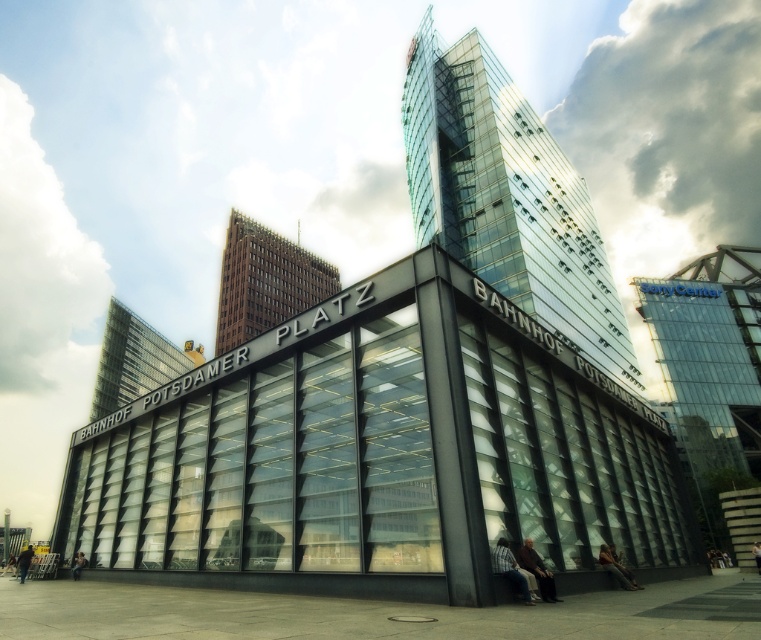
Looking at this image, can you confirm if brown leather jacket at lower right is smaller than dark blue jeans at lower left?

Yes.

Is brown leather jacket at lower right shorter than dark blue jeans at lower left?

Yes.

Between point (521, 552) and point (21, 570), which one is positioned behind?

Positioned behind is point (21, 570).

At what (x,y) coordinates should I click in order to perform the action: click on brown leather jacket at lower right. Please return your answer as a coordinate pair (x, y). Looking at the image, I should click on (537, 570).

Can you confirm if glassy steel structure at center is thinner than dark blue jeans at lower left?

No.

Is glassy steel structure at center bigger than dark blue jeans at lower left?

Yes.

Which is in front, point (250, 512) or point (24, 556)?

Point (250, 512)

This screenshot has height=640, width=761. I want to click on glassy steel structure at center, so click(380, 456).

Which of these two, dark blue jeans at lower left or dark gray concrete person at lower left, stands taller?

Standing taller between the two is dark blue jeans at lower left.

Is point (24, 560) more distant than point (81, 554)?

Yes, it is.

This screenshot has width=761, height=640. What are the coordinates of `dark blue jeans at lower left` in the screenshot? It's located at point(24,561).